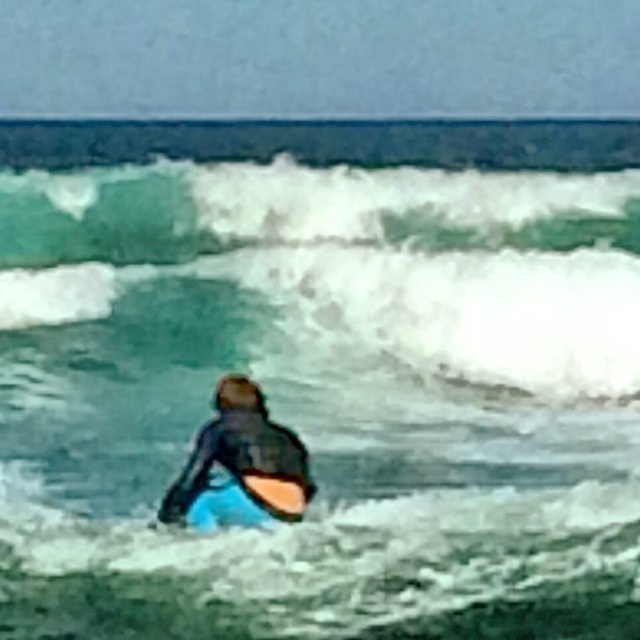
Between green translucent water at upper center and orange foam surfboard at center, which one appears on the left side from the viewer's perspective?

orange foam surfboard at center is more to the left.

Is point (275, 172) positioned in front of point (280, 502)?

No, (275, 172) is further to viewer.

Find the location of a particular element. This screenshot has height=640, width=640. green translucent water at upper center is located at coordinates (356, 257).

Looking at this image, is the position of green translucent water at upper center less distant than that of black matte wetsuit at center?

No, it is behind black matte wetsuit at center.

The image size is (640, 640). Describe the element at coordinates (356, 257) in the screenshot. I see `green translucent water at upper center` at that location.

At what (x,y) coordinates should I click in order to perform the action: click on green translucent water at upper center. Please return your answer as a coordinate pair (x, y). This screenshot has height=640, width=640. Looking at the image, I should click on (356, 257).

The width and height of the screenshot is (640, 640). Identify the location of green translucent water at upper center. (356, 257).

Does black matte wetsuit at center appear over orange foam surfboard at center?

Yes.

Which of these two, black matte wetsuit at center or orange foam surfboard at center, stands taller?

black matte wetsuit at center is taller.

Does point (291, 436) come closer to viewer compared to point (296, 513)?

No, (291, 436) is further to viewer.

Locate an element on the screen. Image resolution: width=640 pixels, height=640 pixels. black matte wetsuit at center is located at coordinates (236, 456).